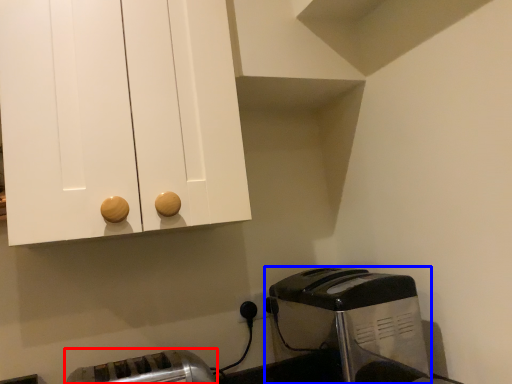
Question: Which object is further to the camera taking this photo, toaster (highlighted by a red box) or toaster (highlighted by a blue box)?

Choices:
 (A) toaster
 (B) toaster

Answer: (B)